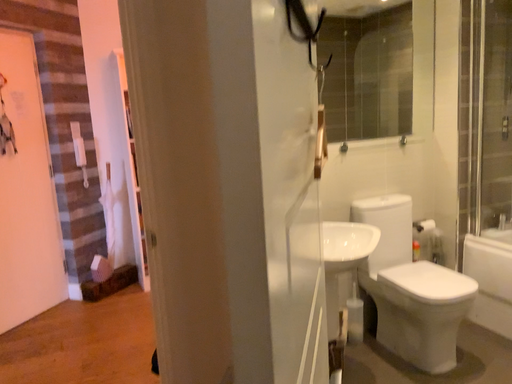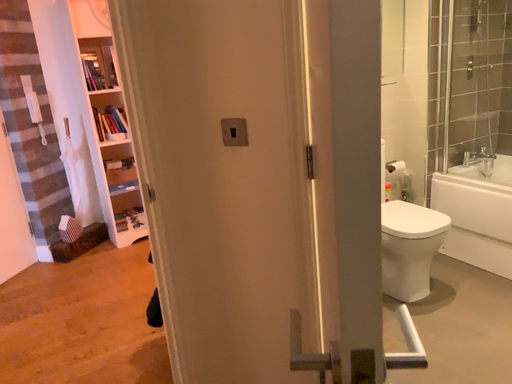
Question: How did the camera likely rotate when shooting the video?

Choices:
 (A) rotated downward
 (B) rotated upward

Answer: (A)